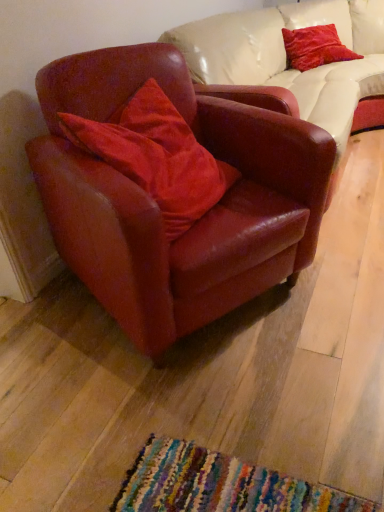
Question: From the image's perspective, does leather armchair at left appear lower than velvet red pillow at center, which is counted as the 2th pillow, starting from the back?

Choices:
 (A) no
 (B) yes

Answer: (B)

Question: From the image's perspective, does leather armchair at left appear higher than velvet red pillow at center, which appears as the 1th pillow when ordered from the bottom?

Choices:
 (A) yes
 (B) no

Answer: (B)

Question: Can you confirm if leather armchair at left is shorter than velvet red pillow at center, which appears as the 1th pillow when ordered from the bottom?

Choices:
 (A) no
 (B) yes

Answer: (A)

Question: Is leather armchair at left positioned with its back to velvet red pillow at center, which is counted as the 2th pillow, starting from the back?

Choices:
 (A) yes
 (B) no

Answer: (A)

Question: Considering the relative sizes of leather armchair at left and velvet red pillow at center, which is counted as the 2th pillow, starting from the back, in the image provided, is leather armchair at left thinner than velvet red pillow at center, which is counted as the 2th pillow, starting from the back,?

Choices:
 (A) yes
 (B) no

Answer: (B)

Question: Does point (264, 138) appear closer or farther from the camera than point (99, 130)?

Choices:
 (A) closer
 (B) farther

Answer: (B)

Question: From a real-world perspective, is leather armchair at left above or below velvet red pillow at center, which ranks as the 2th pillow in right-to-left order?

Choices:
 (A) below
 (B) above

Answer: (A)

Question: Based on their positions, is leather armchair at left located to the left or right of velvet red pillow at center, arranged as the first pillow when viewed from the left?

Choices:
 (A) left
 (B) right

Answer: (B)

Question: Considering the positions of leather armchair at left and velvet red pillow at center, which is counted as the 2th pillow, starting from the back, in the image, is leather armchair at left taller or shorter than velvet red pillow at center, which is counted as the 2th pillow, starting from the back,?

Choices:
 (A) tall
 (B) short

Answer: (A)

Question: Considering their positions, is leather armchair at left located in front of or behind velvet red pillow at upper right, arranged as the 2th pillow when ordered from the bottom?

Choices:
 (A) front
 (B) behind

Answer: (A)

Question: From a real-world perspective, is leather armchair at left physically located above or below velvet red pillow at upper right, arranged as the first pillow when viewed from the top?

Choices:
 (A) above
 (B) below

Answer: (B)

Question: Is leather armchair at left wider or thinner than velvet red pillow at upper right, which ranks as the first pillow in right-to-left order?

Choices:
 (A) thin
 (B) wide

Answer: (B)

Question: In the image, is leather armchair at left on the left side or the right side of velvet red pillow at upper right, the 2th pillow from the left?

Choices:
 (A) left
 (B) right

Answer: (A)

Question: Is velvet red pillow at center, which is the first pillow in front-to-back order, wider or thinner than velvet red pillow at upper right, the 2th pillow from the left?

Choices:
 (A) wide
 (B) thin

Answer: (A)

Question: From a real-world perspective, is velvet red pillow at center, which appears as the 1th pillow when ordered from the bottom, physically located above or below velvet red pillow at upper right, the 2th pillow from the left?

Choices:
 (A) below
 (B) above

Answer: (B)